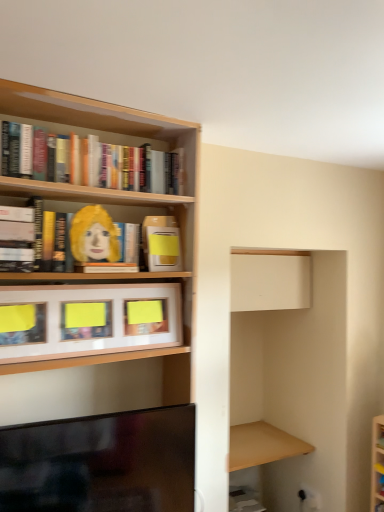
Question: In terms of height, does white matte cabinet at upper center, which is counted as the first cabinet, starting from the right, look taller or shorter compared to matte yellow book at upper center, acting as the 4th book starting from the top?

Choices:
 (A) short
 (B) tall

Answer: (B)

Question: In terms of width, does white matte cabinet at upper center, which is counted as the first cabinet, starting from the right, look wider or thinner when compared to matte yellow book at upper center, acting as the 4th book starting from the top?

Choices:
 (A) wide
 (B) thin

Answer: (A)

Question: Which is farther from the hardcover book at left, acting as the 2th book starting from the bottom?

Choices:
 (A) wooden at right
 (B) black glossy tv at lower left
 (C) hardcover books at upper left, the 4th book when ordered from bottom to top
 (D) white matte cabinet at upper center, arranged as the 2th cabinet when viewed from the left
 (E) wooden frame at center, marked as the 1th cabinet in a front-to-back arrangement

Answer: (A)

Question: Based on their relative distances, which object is farther from the wooden at right?

Choices:
 (A) matte yellow paper at upper left
 (B) wooden frame at center, which is the 1th cabinet from left to right
 (C) black glossy tv at lower left
 (D) hardcover book at left, the 3th book when ordered from top to bottom
 (E) hardcover books at upper left, the 4th book when ordered from bottom to top

Answer: (D)